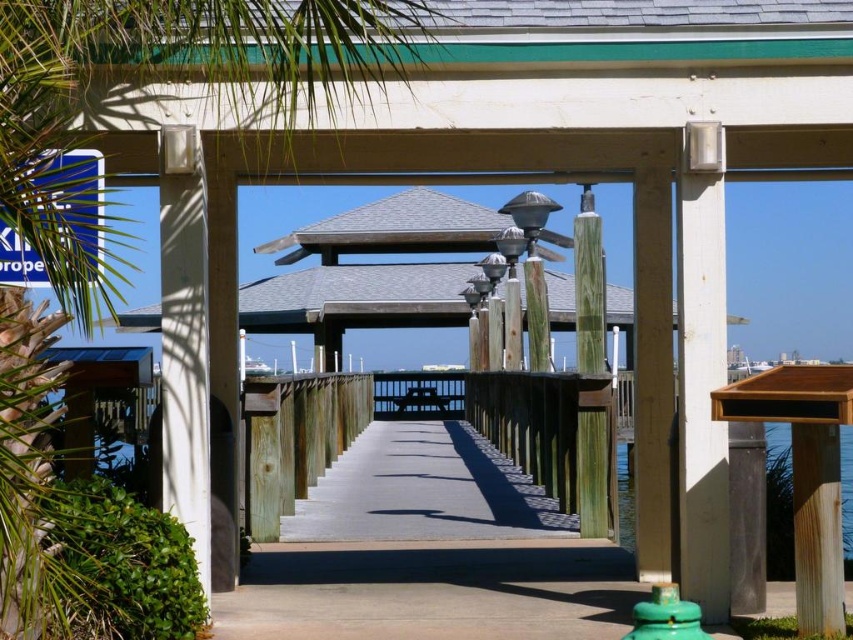
You are standing at the point with coordinates point [656,602] and want to walk towards the distant gazebo. Is the point point [184,8] blocking your path?

Point [184,8] is behind point [656,602], so it is not blocking your path.

You are standing under the wooden pergola and notice a green leafy palm tree at left and a green weathered wood post at center. Which object is higher from the ground?

The green leafy palm tree at left is above the green weathered wood post at center, so it is higher from the ground.

You are a painter standing at the center of the wooden pergola. You want to paint both the green leafy palm tree at left and the green matte hydrant at lower center. Which object will require you to tilt your head more upwards to view its top?

The green leafy palm tree at left has a greater height compared to the green matte hydrant at lower center, so you will need to tilt your head more upwards to view the top of the green leafy palm tree at left.